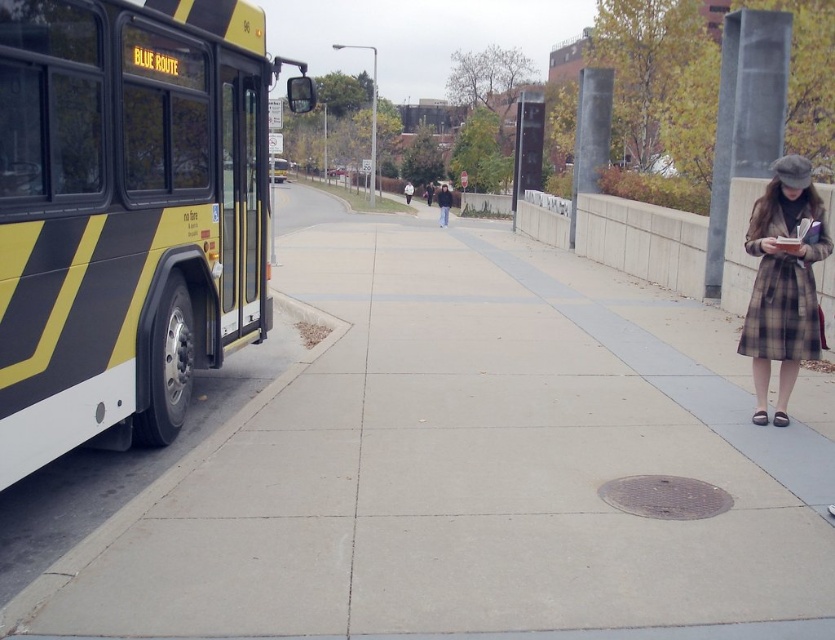
Between point (78, 92) and point (446, 212), which one is positioned in front?

Positioned in front is point (78, 92).

Does yellow and black painted bus at left appear over dark gray coat at center?

Incorrect, yellow and black painted bus at left is not positioned above dark gray coat at center.

Between point (84, 188) and point (444, 211), which one is positioned behind?

The point (444, 211) is behind.

The image size is (835, 640). What are the coordinates of `yellow and black painted bus at left` in the screenshot? It's located at (127, 212).

Which is more to the left, concrete sidewalk at left or dark gray coat at center?

Positioned to the left is dark gray coat at center.

Can you confirm if concrete sidewalk at left is positioned to the right of dark gray coat at center?

Yes, concrete sidewalk at left is to the right of dark gray coat at center.

Is point (753, 556) farther from camera compared to point (438, 192)?

No.

This screenshot has height=640, width=835. I want to click on concrete sidewalk at left, so click(479, 465).

Is concrete sidewalk at left to the right of yellow and black painted bus at left from the viewer's perspective?

Yes, concrete sidewalk at left is to the right of yellow and black painted bus at left.

Consider the image. Who is more distant from viewer, (596,300) or (171,58)?

The point (596,300) is more distant.

Locate an element on the screen. This screenshot has height=640, width=835. concrete sidewalk at left is located at coordinates (479, 465).